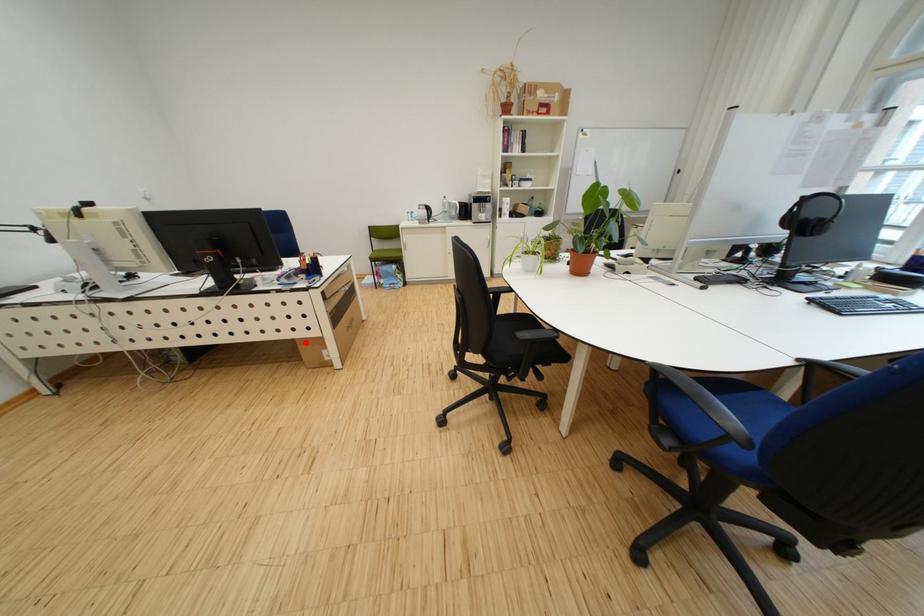
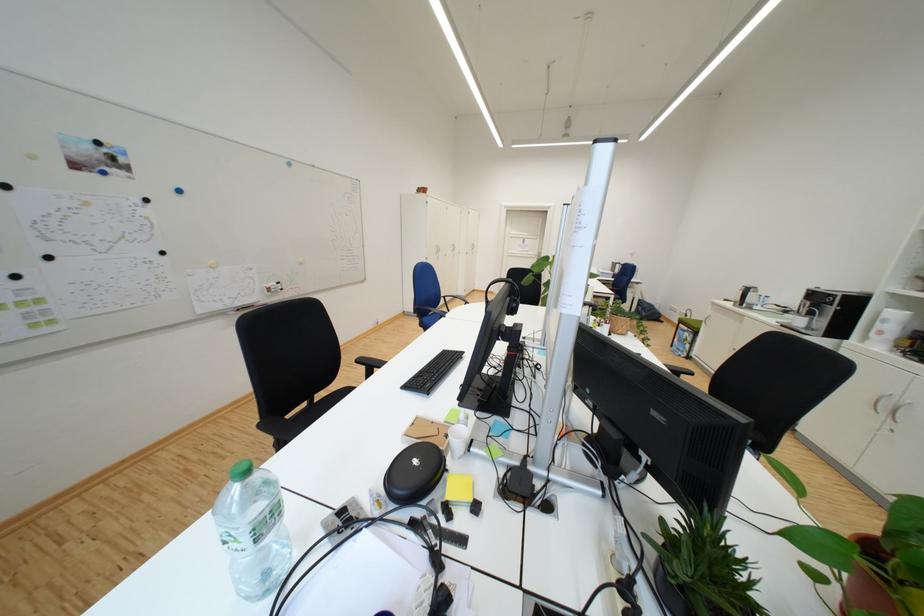
Question: I am providing you with two images of the same scene from different viewpoints. A red point is marked on the first image. Is the red point's position out of view in image 2?

Choices:
 (A) Yes
 (B) No

Answer: (A)